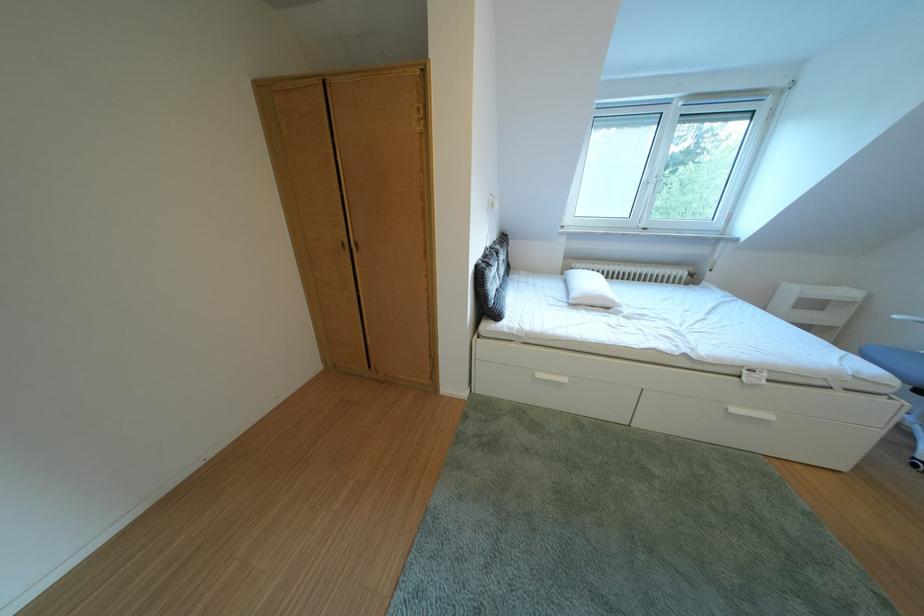
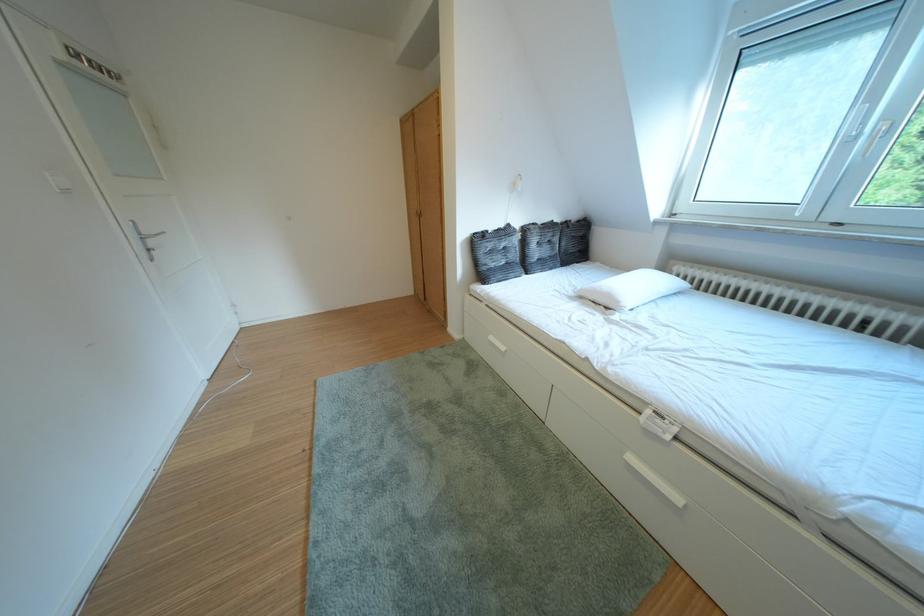
Locate, in the second image, the point that corresponds to (748,415) in the first image.

(646, 464)